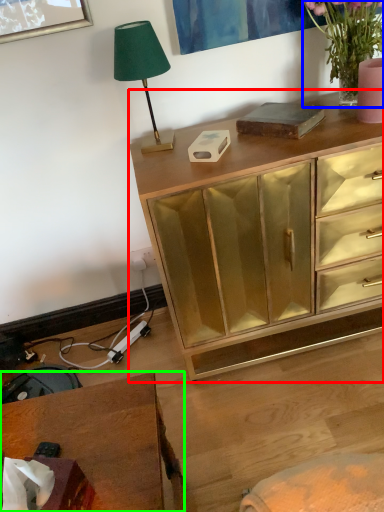
Question: Considering the real-world distances, which object is farthest from chest of drawers (highlighted by a red box)? houseplant (highlighted by a blue box) or desk (highlighted by a green box)?

Choices:
 (A) houseplant
 (B) desk

Answer: (B)